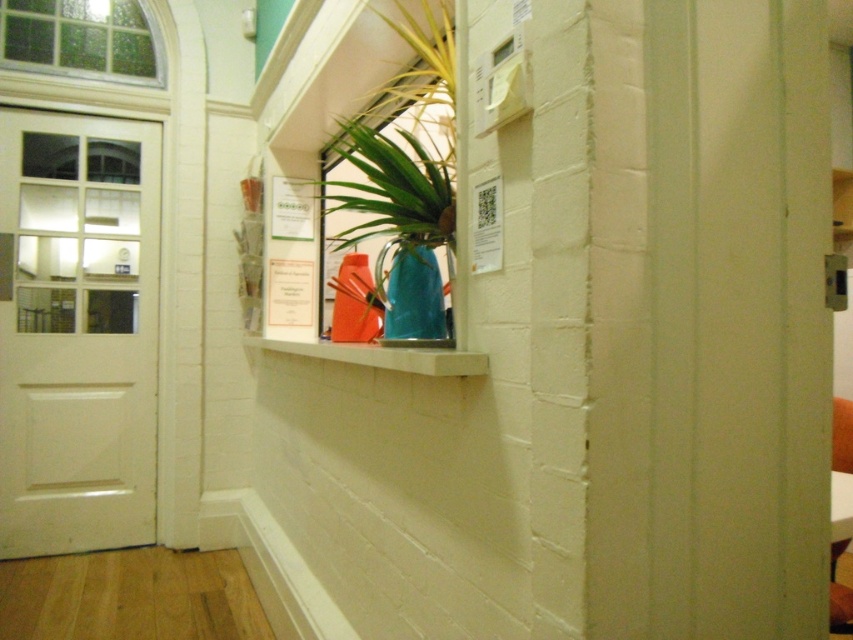
You are standing in the hallway and want to place a new painting between the blue glass vase at center and the stained glass window at upper left. Can you fit it there?

The blue glass vase at center is to the right of the stained glass window at upper left, so there is space between them to place the new painting.

You are a maintenance worker needing to replace a broken stained glass window. You see the blue glass vase at center and the stained glass window at upper left. Which object is higher up in the image?

The stained glass window at upper left is higher up in the image than the blue glass vase at center.

You are a delivery person trying to move a large package through the white glossy door at left. The package is as wide as the matte blue vase at center. Will the package fit through the door?

The white glossy door at left is wider than the matte blue vase at center, so the package, which is as wide as the vase, will fit through the door.